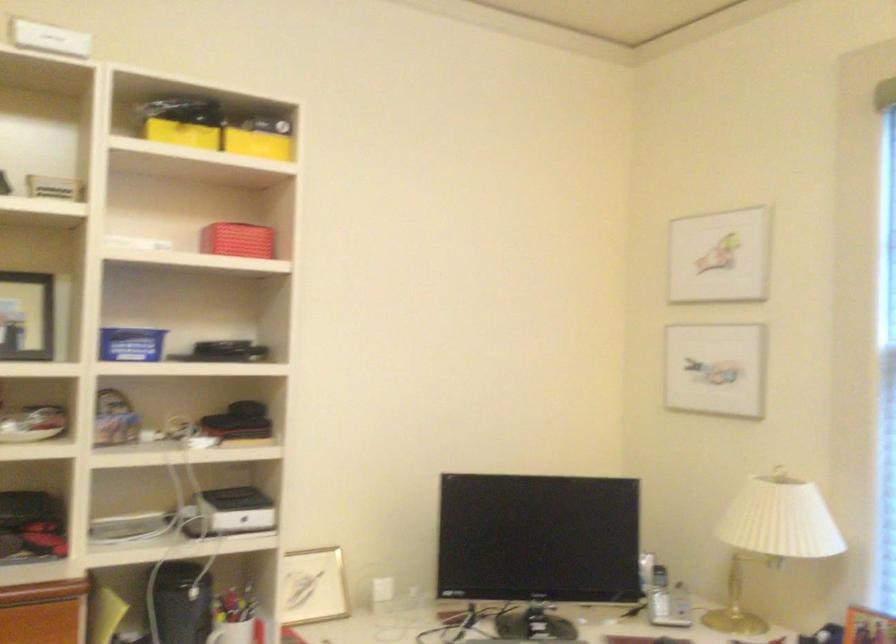
Identify the location of desk lamp. (771, 538).